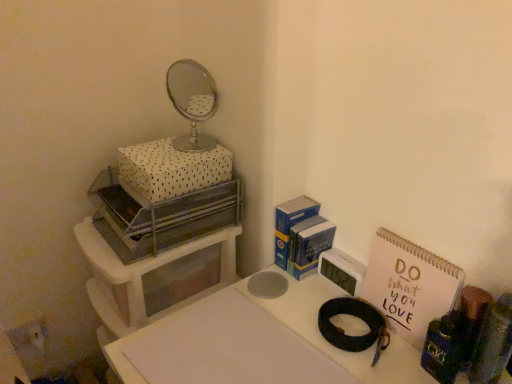
Question: Can you confirm if white matte table at center is bigger than shiny metallic magnifying glass at upper center?

Choices:
 (A) no
 (B) yes

Answer: (B)

Question: Is white matte table at center beside shiny metallic magnifying glass at upper center?

Choices:
 (A) no
 (B) yes

Answer: (A)

Question: Is white matte table at center behind shiny metallic magnifying glass at upper center?

Choices:
 (A) yes
 (B) no

Answer: (B)

Question: From a real-world perspective, is white matte table at center below shiny metallic magnifying glass at upper center?

Choices:
 (A) no
 (B) yes

Answer: (B)

Question: Is white matte table at center positioned in front of shiny metallic magnifying glass at upper center?

Choices:
 (A) no
 (B) yes

Answer: (B)

Question: In terms of size, does white plastic storage unit at left appear bigger or smaller than shiny metallic magnifying glass at upper center?

Choices:
 (A) small
 (B) big

Answer: (B)

Question: Is point (223, 283) positioned closer to the camera than point (366, 334)?

Choices:
 (A) farther
 (B) closer

Answer: (A)

Question: From the image's perspective, is white plastic storage unit at left located above or below shiny metallic magnifying glass at upper center?

Choices:
 (A) above
 (B) below

Answer: (B)

Question: Is white plastic storage unit at left taller or shorter than shiny metallic magnifying glass at upper center?

Choices:
 (A) short
 (B) tall

Answer: (B)

Question: Is point (192, 238) closer or farther from the camera than point (232, 294)?

Choices:
 (A) farther
 (B) closer

Answer: (A)

Question: Is metallic silver tray at upper left, the 1th appliance when ordered from left to right, spatially inside white matte table at center, or outside of it?

Choices:
 (A) outside
 (B) inside

Answer: (A)

Question: Is metallic silver tray at upper left, acting as the 3th appliance starting from the right, bigger or smaller than white matte table at center?

Choices:
 (A) small
 (B) big

Answer: (A)

Question: Is metallic silver tray at upper left, which ranks as the 2th appliance in back-to-front order, in front of or behind white matte table at center in the image?

Choices:
 (A) front
 (B) behind

Answer: (B)

Question: Is point (381, 309) closer or farther from the camera than point (355, 364)?

Choices:
 (A) closer
 (B) farther

Answer: (B)

Question: In terms of size, does pink paper notebook at right appear bigger or smaller than white matte table at center?

Choices:
 (A) big
 (B) small

Answer: (B)